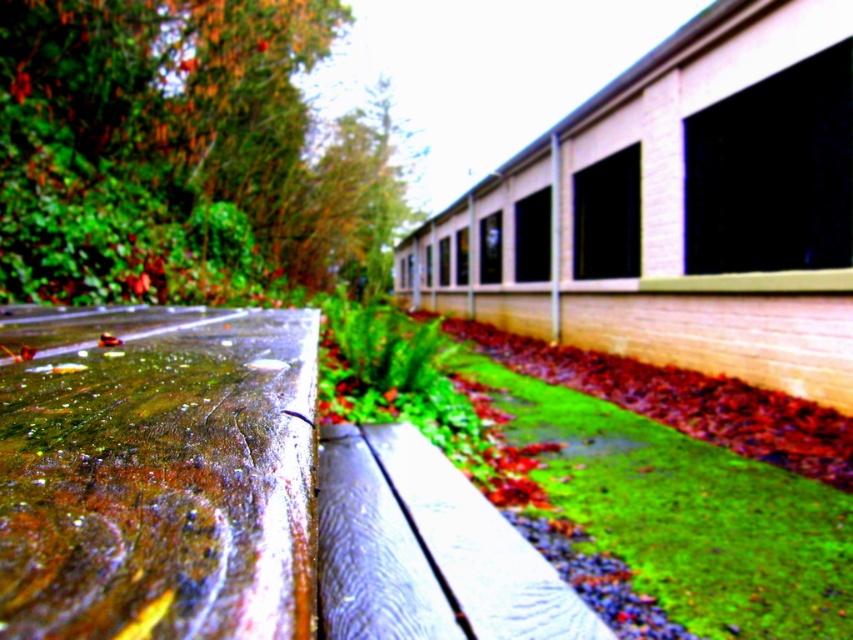
Looking at this image, you are a gardener who needs to mow the green mossy grass at lower right. However, there is a wet wood bench at lower left in the way. Can you mow the grass without moving the bench?

The wet wood bench at lower left is positioned over green mossy grass at lower right, so the bench is covering part of the grass. You will need to move the bench to mow the entire area of the green mossy grass at lower right.

You are a gardener trying to place a new decorative stone between the wet wood bench at lower left and the green mossy grass at lower right. Which side should you place it on if you want it closer to the thinner object?

You should place the decorative stone closer to the wet wood bench at lower left because it is thinner than the green mossy grass at lower right.

You are a photographer holding a camera and want to capture a closeup shot of the wet wood bench at lower left. The camera requires the subject to be at least 20 centimeters away to focus properly. Based on the scene description, will the bench be in focus?

The wet wood bench at lower left is only 18.73 centimeters away from the camera, which is less than the required 20 centimeters. Therefore, the bench will not be in focus.